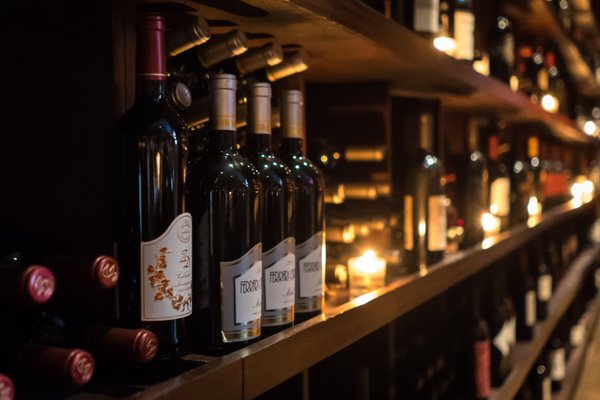
Locate an element on the screen. wood shelves is located at coordinates (378, 303), (518, 362), (426, 62), (543, 22), (573, 385).